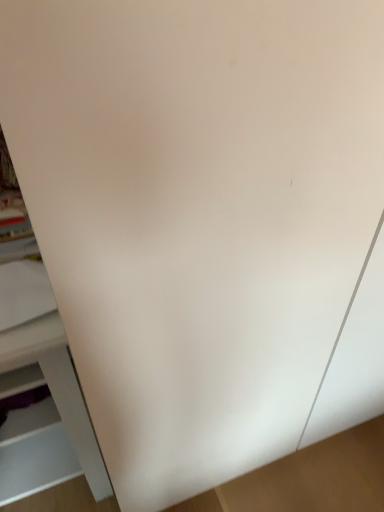
Measure the distance between white matte cabinet at left and camera.

white matte cabinet at left is 26.38 inches away from camera.

Looking at this image, measure the distance between point (47, 333) and camera.

The distance of point (47, 333) from camera is 27.28 inches.

What do you see at coordinates (58, 388) in the screenshot?
I see `white matte cabinet at left` at bounding box center [58, 388].

Find the location of a particular element. The image size is (384, 512). white matte cabinet at left is located at coordinates (58, 388).

At what (x,y) coordinates should I click in order to perform the action: click on white matte cabinet at left. Please return your answer as a coordinate pair (x, y). Image resolution: width=384 pixels, height=512 pixels. Looking at the image, I should click on (58, 388).